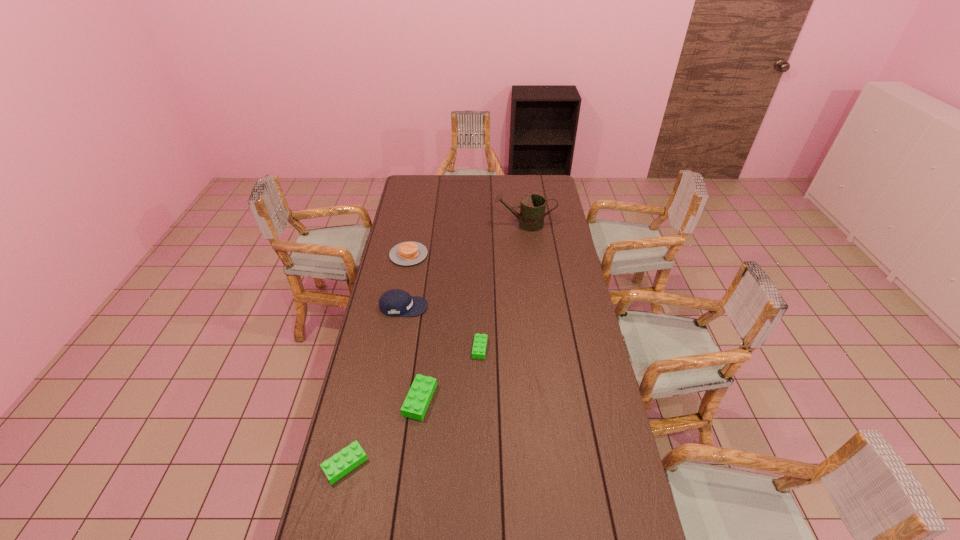
Locate an element on the screen. pancake present at the left edge is located at coordinates (406, 253).

Locate an element on the screen. The width and height of the screenshot is (960, 540). baseball cap that is at the left edge is located at coordinates pos(395,302).

Locate an element on the screen. This screenshot has height=540, width=960. object positioned at the right edge is located at coordinates [x=532, y=206].

At what (x,y) coordinates should I click in order to perform the action: click on vacant space at the far edge of the desktop. Please return your answer as a coordinate pair (x, y). This screenshot has width=960, height=540. Looking at the image, I should click on (444, 178).

In the image, there is a desktop. Find the location of `vacant space at the near edge`. vacant space at the near edge is located at coordinates (445, 528).

This screenshot has width=960, height=540. Identify the location of free location at the left edge. (332, 492).

Locate an element on the screen. Image resolution: width=960 pixels, height=540 pixels. free space at the right edge of the desktop is located at coordinates (552, 290).

At what (x,y) coordinates should I click in order to perform the action: click on free space between the farthest Lego and the second Lego from right to left. Please return your answer as a coordinate pair (x, y). The height and width of the screenshot is (540, 960). Looking at the image, I should click on (450, 374).

This screenshot has width=960, height=540. Find the location of `free space between the fifth farthest object and the nearest object`. free space between the fifth farthest object and the nearest object is located at coordinates (382, 432).

This screenshot has height=540, width=960. I want to click on free point between the fifth nearest object and the tallest object, so click(467, 239).